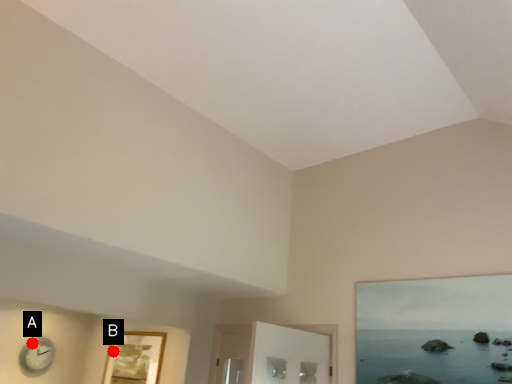
Question: Two points are circled on the image, labeled by A and B beside each circle. Which of the following is the farthest from the observer?

Choices:
 (A) A is further
 (B) B is further

Answer: (B)